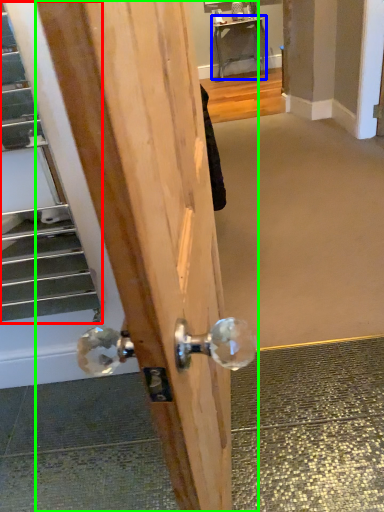
Question: Considering the real-world distances, which object is farthest from escalator (highlighted by a red box)? table (highlighted by a blue box) or door (highlighted by a green box)?

Choices:
 (A) table
 (B) door

Answer: (A)